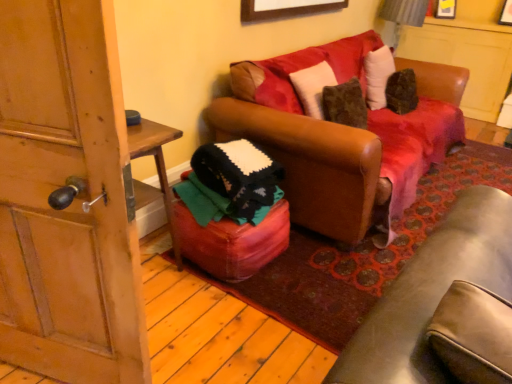
Question: Can you confirm if wooden picture frame at upper center is thinner than wooden door at left?

Choices:
 (A) no
 (B) yes

Answer: (B)

Question: Considering the relative positions of wooden picture frame at upper center and wooden door at left in the image provided, is wooden picture frame at upper center behind wooden door at left?

Choices:
 (A) yes
 (B) no

Answer: (A)

Question: Is wooden door at left located within wooden picture frame at upper center?

Choices:
 (A) no
 (B) yes

Answer: (A)

Question: Is wooden picture frame at upper center to the left of wooden door at left from the viewer's perspective?

Choices:
 (A) yes
 (B) no

Answer: (B)

Question: Considering the relative positions of wooden picture frame at upper center and wooden door at left in the image provided, is wooden picture frame at upper center in front of wooden door at left?

Choices:
 (A) no
 (B) yes

Answer: (A)

Question: Which is correct: wooden door at left is inside leather ottoman at center, or outside of it?

Choices:
 (A) outside
 (B) inside

Answer: (A)

Question: Is wooden door at left taller or shorter than leather ottoman at center?

Choices:
 (A) tall
 (B) short

Answer: (A)

Question: From the image's perspective, is wooden door at left located above or below leather ottoman at center?

Choices:
 (A) below
 (B) above

Answer: (B)

Question: Relative to leather ottoman at center, is wooden door at left in front or behind?

Choices:
 (A) behind
 (B) front

Answer: (B)

Question: Considering the positions of point (243, 8) and point (8, 311), is point (243, 8) closer or farther from the camera than point (8, 311)?

Choices:
 (A) farther
 (B) closer

Answer: (A)

Question: Is wooden picture frame at upper center situated inside wooden door at left or outside?

Choices:
 (A) outside
 (B) inside

Answer: (A)

Question: Considering the positions of wooden picture frame at upper center and wooden door at left in the image, is wooden picture frame at upper center wider or thinner than wooden door at left?

Choices:
 (A) thin
 (B) wide

Answer: (A)

Question: From a real-world perspective, is wooden picture frame at upper center above or below wooden door at left?

Choices:
 (A) above
 (B) below

Answer: (A)

Question: From their relative heights in the image, would you say wooden door at left is taller or shorter than wooden picture frame at upper center?

Choices:
 (A) tall
 (B) short

Answer: (A)

Question: Considering the positions of point (2, 347) and point (315, 6), is point (2, 347) closer or farther from the camera than point (315, 6)?

Choices:
 (A) closer
 (B) farther

Answer: (A)